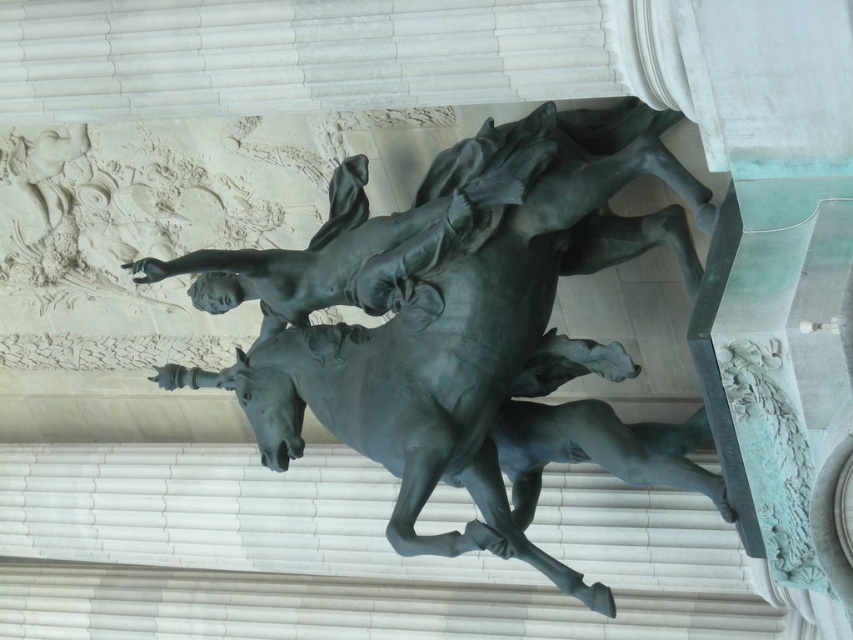
Can you confirm if bronze statue at center is positioned below bronze statue at upper center?

Correct, bronze statue at center is located below bronze statue at upper center.

In the scene shown: Can you confirm if bronze statue at center is positioned above bronze statue at upper center?

Incorrect, bronze statue at center is not positioned above bronze statue at upper center.

Is point (509, 397) closer to camera compared to point (178, 262)?

No.

Locate an element on the screen. Image resolution: width=853 pixels, height=640 pixels. bronze statue at center is located at coordinates (463, 324).